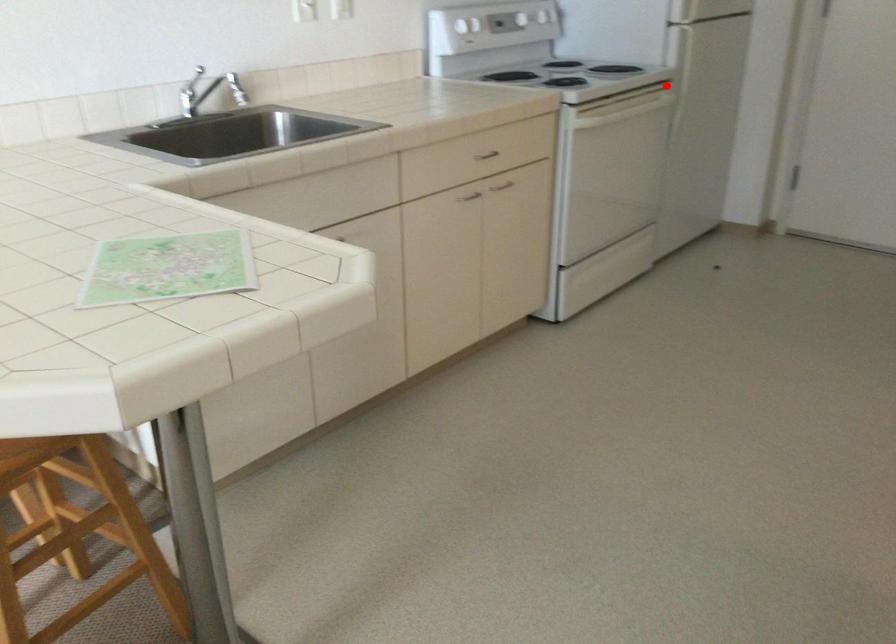
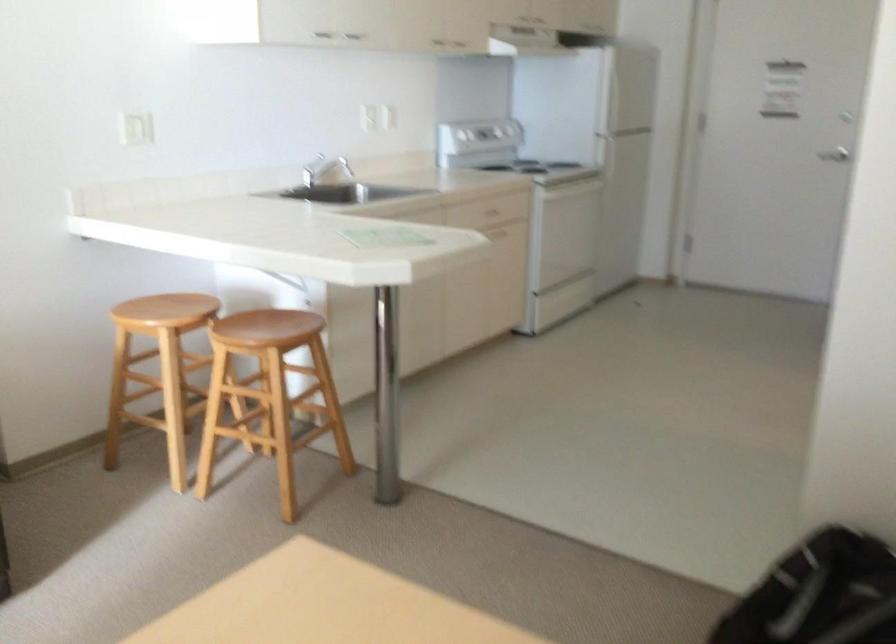
Question: I am providing you with two images of the same scene from different viewpoints. In image1, a red point is highlighted. Considering the same 3D point in image2, which of the following is correct?

Choices:
 (A) It is closer
 (B) It is farther

Answer: (B)